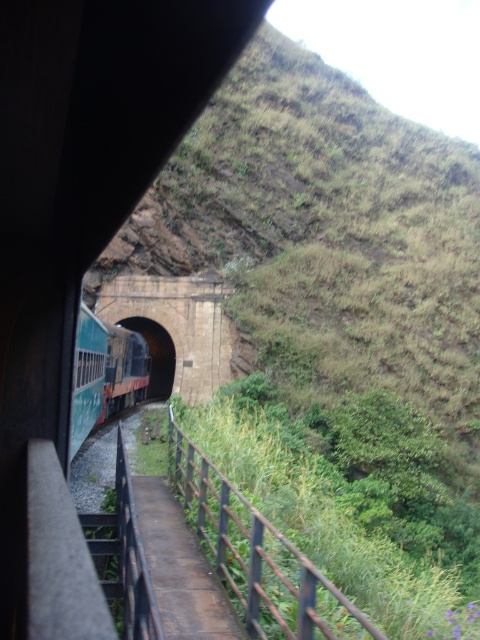
You are a passenger sitting in the train and looking out the window. You notice the brown metal rail at lower center and the brick tunnel at center. Which object appears taller from your viewpoint?

The brick tunnel at center appears taller than the brown metal rail at lower center because the brown metal rail at lower center is not as tall as the brick tunnel at center.